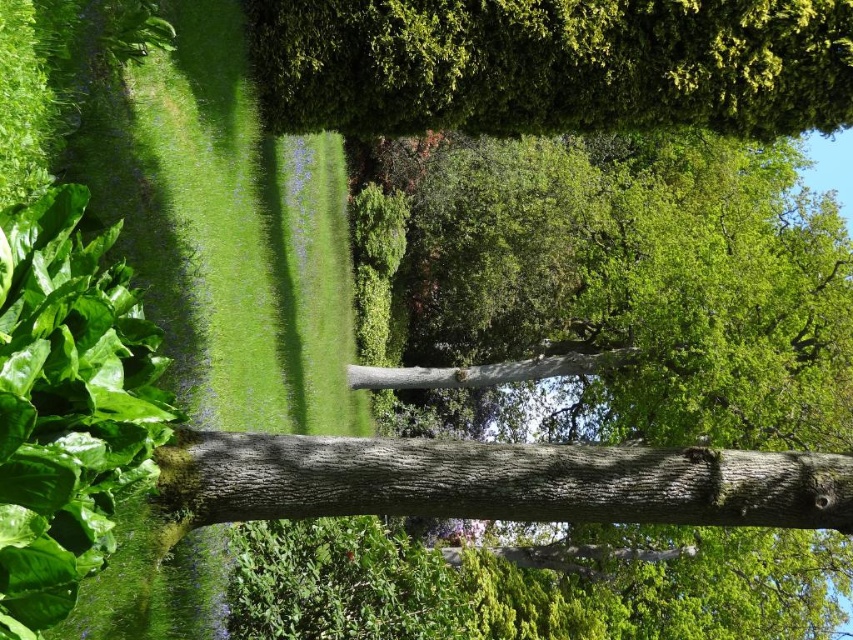
Question: Observing the image, what is the correct spatial positioning of green leafy tree at upper center in reference to smooth brown tree trunk at center?

Choices:
 (A) right
 (B) left

Answer: (A)

Question: Does green leafy tree at upper center have a smaller size compared to smooth brown tree trunk at center?

Choices:
 (A) no
 (B) yes

Answer: (A)

Question: Among these points, which one is nearest to the camera?

Choices:
 (A) (393, 42)
 (B) (363, 500)

Answer: (B)

Question: Which point is farther from the camera taking this photo?

Choices:
 (A) (469, 451)
 (B) (289, 124)

Answer: (B)

Question: Can you confirm if green leafy tree at upper center is wider than smooth brown tree trunk at center?

Choices:
 (A) no
 (B) yes

Answer: (B)